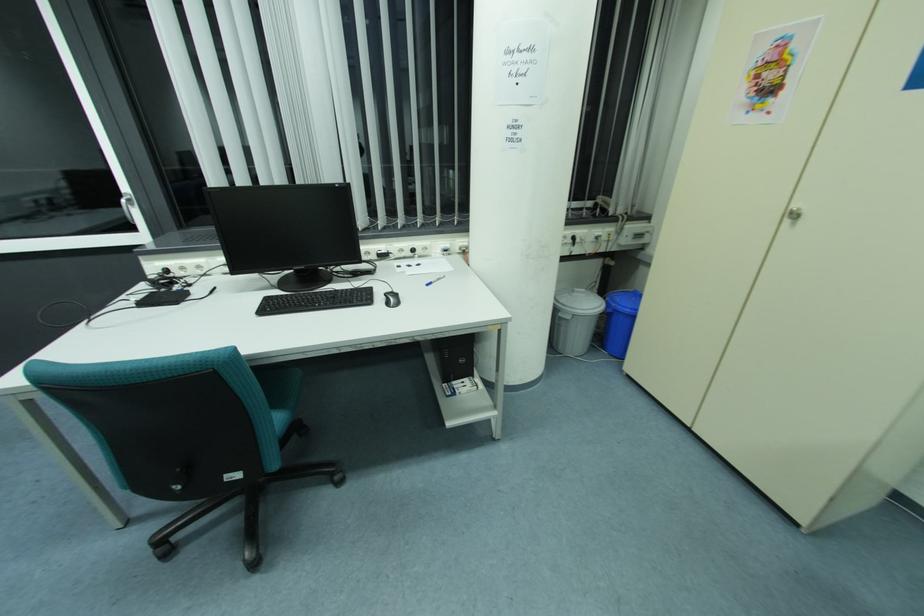
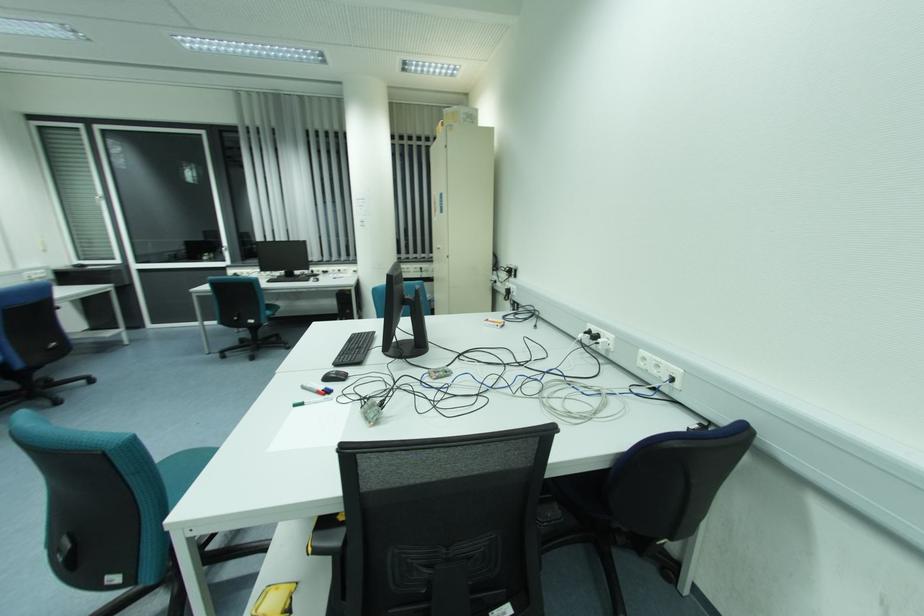
Which direction would the cameraman need to move to produce the second image?

The movement direction of the cameraman is right, backward.